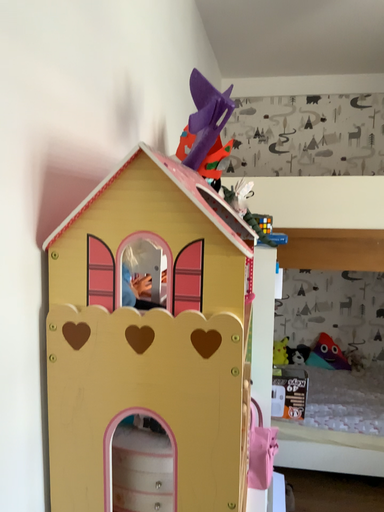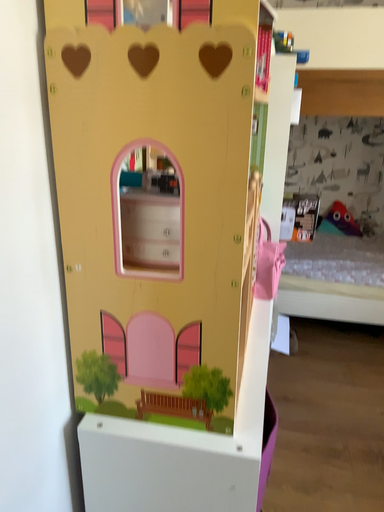
Question: Which way did the camera rotate in the video?

Choices:
 (A) rotated upward
 (B) rotated downward

Answer: (B)